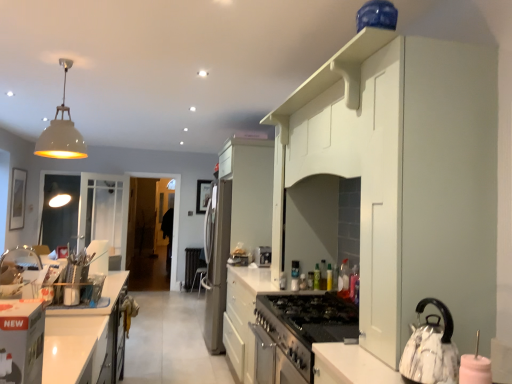
Question: Considering the relative sizes of green matte bottle at center, the 5th bottle viewed from the front, and satin stainless steel refrigerator at center, the 1th appliance when ordered from left to right, in the image provided, is green matte bottle at center, the 5th bottle viewed from the front, wider than satin stainless steel refrigerator at center, the 1th appliance when ordered from left to right,?

Choices:
 (A) no
 (B) yes

Answer: (A)

Question: Does green matte bottle at center, the 5th bottle viewed from the front, turn towards satin stainless steel refrigerator at center, the fourth appliance when ordered from front to back?

Choices:
 (A) yes
 (B) no

Answer: (B)

Question: Is green matte bottle at center, which is the first bottle in back-to-front order, outside of satin stainless steel refrigerator at center, the 1th appliance when ordered from left to right?

Choices:
 (A) yes
 (B) no

Answer: (A)

Question: Is green matte bottle at center, the 5th bottle viewed from the front, positioned far away from satin stainless steel refrigerator at center, the fourth appliance when ordered from front to back?

Choices:
 (A) no
 (B) yes

Answer: (B)

Question: Is green matte bottle at center, which is the first bottle in back-to-front order, positioned with its back to satin stainless steel refrigerator at center, arranged as the fourth appliance when viewed from the right?

Choices:
 (A) yes
 (B) no

Answer: (B)

Question: Are green matte bottle at center, the 5th bottle viewed from the front, and satin stainless steel refrigerator at center, arranged as the fourth appliance when viewed from the right, making contact?

Choices:
 (A) yes
 (B) no

Answer: (B)

Question: Does white matte pendant light at upper left have a larger size compared to translucent plastic bottle at center, acting as the 2th bottle starting from the front?

Choices:
 (A) no
 (B) yes

Answer: (B)

Question: Is white matte pendant light at upper left smaller than translucent plastic bottle at center, acting as the 2th bottle starting from the front?

Choices:
 (A) yes
 (B) no

Answer: (B)

Question: Is white matte pendant light at upper left at the left side of translucent plastic bottle at center, acting as the 4th bottle starting from the back?

Choices:
 (A) yes
 (B) no

Answer: (A)

Question: Would you say white matte pendant light at upper left contains translucent plastic bottle at center, acting as the 2th bottle starting from the front?

Choices:
 (A) no
 (B) yes

Answer: (A)

Question: From a real-world perspective, is white matte pendant light at upper left over translucent plastic bottle at center, acting as the 4th bottle starting from the back?

Choices:
 (A) yes
 (B) no

Answer: (A)

Question: From the image's perspective, is white matte pendant light at upper left on translucent plastic bottle at center, acting as the 4th bottle starting from the back?

Choices:
 (A) no
 (B) yes

Answer: (B)

Question: From the image's perspective, would you say satin silver toaster at center, placed as the second appliance when sorted from bottom to top, is shown under transparent glass door at center?

Choices:
 (A) no
 (B) yes

Answer: (A)